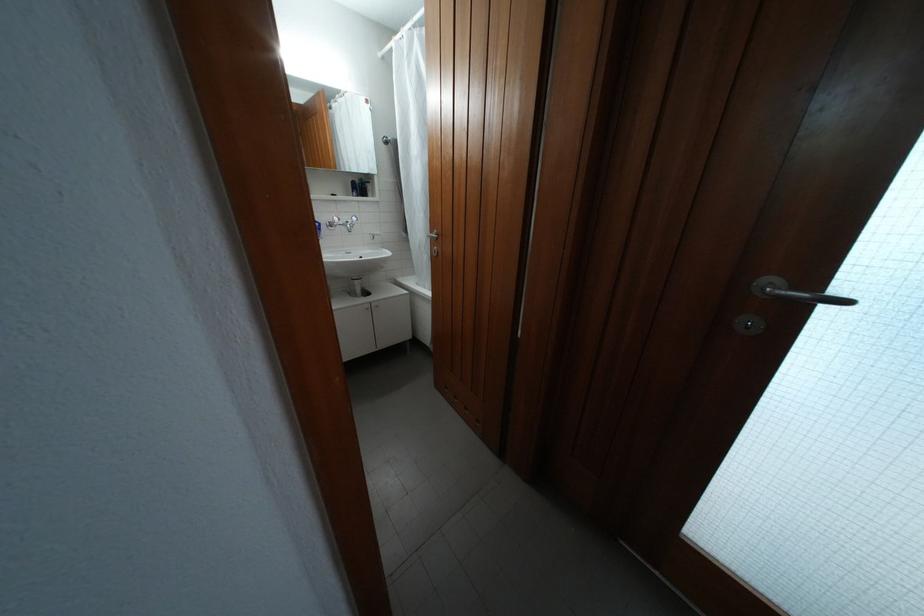
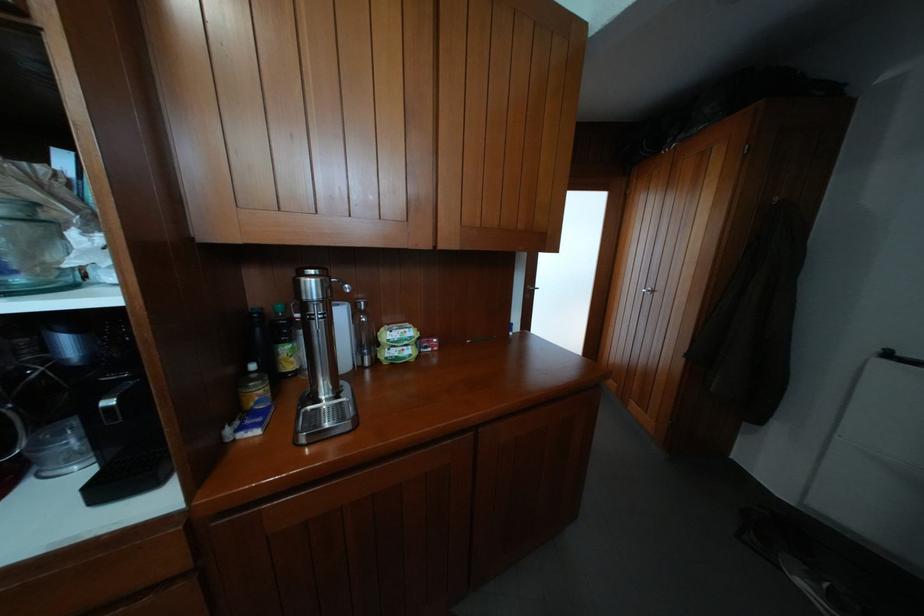
Question: I am providing you with two images of the same scene from different viewpoints. Please identify which objects are invisible in image2.

Choices:
 (A) detergent box handle
 (B) yellow labeled bottle
 (C) metal door handle
 (D) dark bottle

Answer: (C)